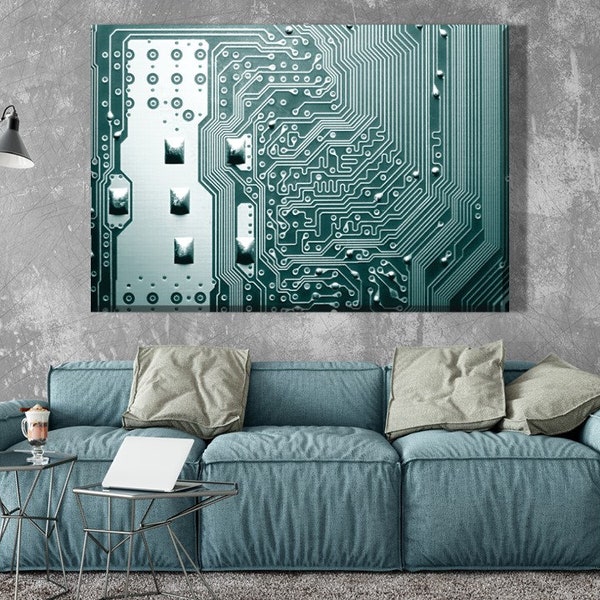
Find the location of a particular element. This screenshot has height=600, width=600. arm rests is located at coordinates (13, 421), (595, 432).